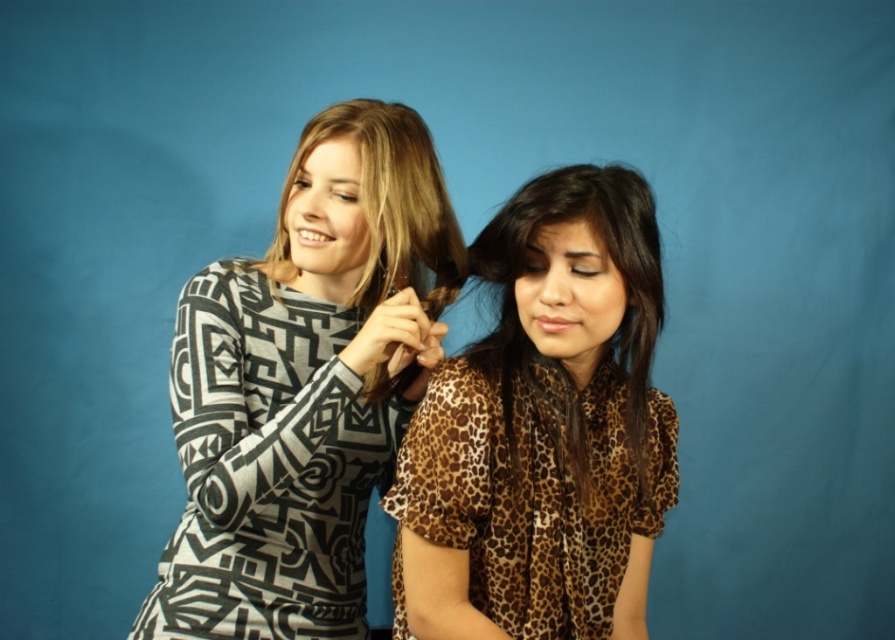
Question: Among these points, which one is nearest to the camera?

Choices:
 (A) (441, 273)
 (B) (601, 250)
 (C) (249, 268)

Answer: (B)

Question: Is leopard print fabric shirt at center positioned in front of leopard print shirt at center?

Choices:
 (A) no
 (B) yes

Answer: (A)

Question: Can you confirm if leopard print fabric shirt at center is positioned below leopard print shirt at center?

Choices:
 (A) yes
 (B) no

Answer: (A)

Question: Which point is closer to the camera?

Choices:
 (A) leopard print shirt at center
 (B) black and white geometric print dress at left
 (C) matte black hair at upper center
 (D) leopard print fabric shirt at center

Answer: (A)

Question: Based on their relative distances, which object is nearer to the leopard print shirt at center?

Choices:
 (A) matte black hair at upper center
 (B) black and white geometric print dress at left
 (C) leopard print fabric shirt at center

Answer: (C)

Question: Is black and white geometric print dress at left above leopard print fabric shirt at center?

Choices:
 (A) no
 (B) yes

Answer: (B)